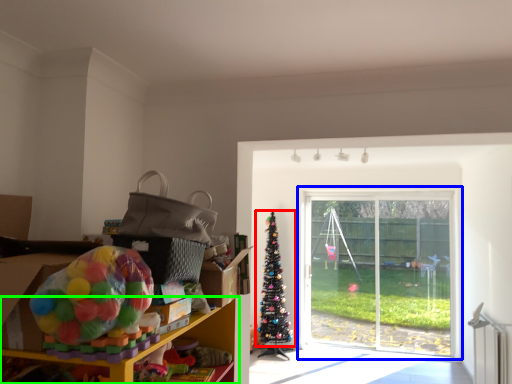
Question: Which object is the closest to the christmas tree (highlighted by a red box)? Choose among these: window (highlighted by a blue box) or shelf (highlighted by a green box).

Choices:
 (A) window
 (B) shelf

Answer: (A)